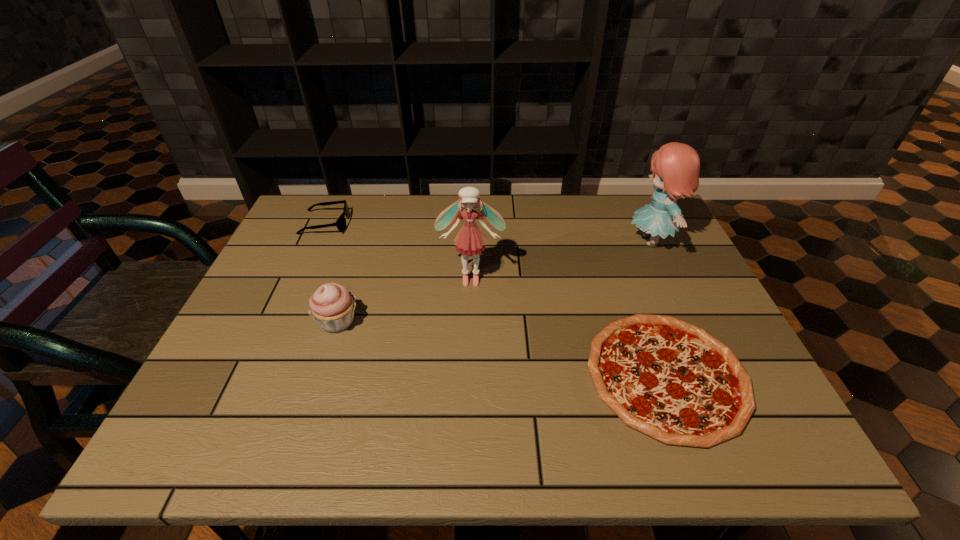
Identify the location of free space located 0.100m on the front-facing side of the third object from right to left. The height and width of the screenshot is (540, 960). (470, 318).

Where is `free space located 0.240m on the front of the cupcake`? free space located 0.240m on the front of the cupcake is located at coordinates (300, 440).

Where is `free space located on the front-facing side of the leftmost object`? This screenshot has width=960, height=540. free space located on the front-facing side of the leftmost object is located at coordinates (424, 224).

This screenshot has height=540, width=960. In order to click on vacant space located 0.100m on the left of the shortest object in this screenshot , I will do `click(540, 375)`.

I want to click on doll located in the far edge section of the desktop, so click(x=675, y=166).

Find the location of a particular element. Image resolution: width=960 pixels, height=540 pixels. sunglasses located at the far edge is located at coordinates (341, 221).

Where is `object positioned at the near edge`? object positioned at the near edge is located at coordinates (671, 380).

Find the location of a particular element. object present at the left edge is located at coordinates (341, 221).

This screenshot has height=540, width=960. In order to click on doll present at the right edge in this screenshot , I will do point(675,166).

Find the location of a particular element. pizza situated at the right edge is located at coordinates (671, 380).